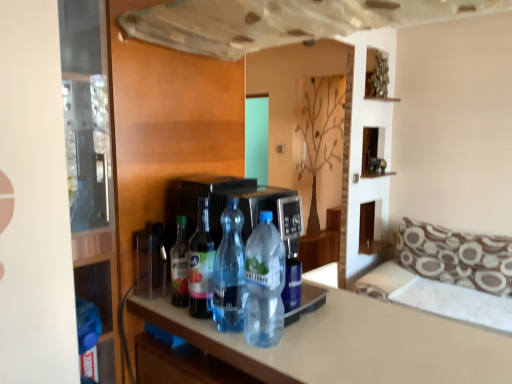
Identify the location of empty space that is ontop of white glossy countertop at center (from a real-world perspective). (354, 336).